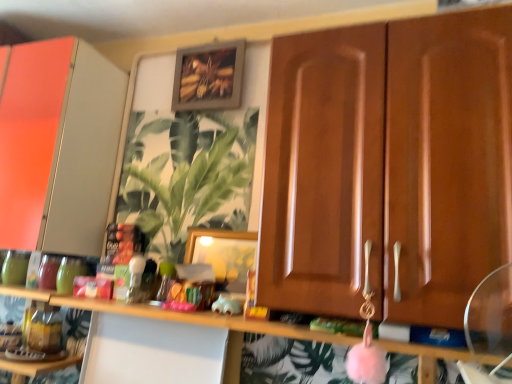
Question: Are wooden cabinet doors at center, which is the 2th cabinetry in left-to-right order, and wooden frame at upper center, marked as the 1th picture frame in a top-to-bottom arrangement, located far from each other?

Choices:
 (A) no
 (B) yes

Answer: (A)

Question: Is wooden cabinet doors at center, which is the 2th cabinetry in left-to-right order, facing towards wooden frame at upper center, acting as the second picture frame starting from the front?

Choices:
 (A) no
 (B) yes

Answer: (A)

Question: Is wooden cabinet doors at center, which is the 2th cabinetry in left-to-right order, bigger than wooden frame at upper center, marked as the 1th picture frame in a top-to-bottom arrangement?

Choices:
 (A) yes
 (B) no

Answer: (A)

Question: Can you confirm if wooden cabinet doors at center, which is the first cabinetry in front-to-back order, is taller than wooden frame at upper center, which is the 1th picture frame in back-to-front order?

Choices:
 (A) yes
 (B) no

Answer: (A)

Question: Is wooden cabinet doors at center, the first cabinetry viewed from the right, shorter than wooden frame at upper center, the 2th picture frame positioned from the bottom?

Choices:
 (A) yes
 (B) no

Answer: (B)

Question: Considering the positions of pink fuzzy ball at center and wooden frame at upper center, which is the 1th picture frame in back-to-front order, in the image, is pink fuzzy ball at center wider or thinner than wooden frame at upper center, which is the 1th picture frame in back-to-front order,?

Choices:
 (A) thin
 (B) wide

Answer: (B)

Question: Would you say pink fuzzy ball at center is inside or outside wooden frame at upper center, acting as the second picture frame starting from the front?

Choices:
 (A) outside
 (B) inside

Answer: (A)

Question: From the image's perspective, is pink fuzzy ball at center above or below wooden frame at upper center, the 2th picture frame positioned from the bottom?

Choices:
 (A) below
 (B) above

Answer: (A)

Question: From a real-world perspective, relative to wooden frame at upper center, which is the 1th picture frame in back-to-front order, is pink fuzzy ball at center vertically above or below?

Choices:
 (A) above
 (B) below

Answer: (B)

Question: Considering the positions of pink fuzzy ball at center and wooden picture frame at center, the 2th picture frame positioned from the back, in the image, is pink fuzzy ball at center wider or thinner than wooden picture frame at center, the 2th picture frame positioned from the back,?

Choices:
 (A) wide
 (B) thin

Answer: (A)

Question: Is pink fuzzy ball at center inside the boundaries of wooden picture frame at center, the 2th picture frame when ordered from top to bottom, or outside?

Choices:
 (A) outside
 (B) inside

Answer: (A)

Question: Considering the relative positions of pink fuzzy ball at center and wooden picture frame at center, positioned as the first picture frame in bottom-to-top order, in the image provided, is pink fuzzy ball at center to the left or to the right of wooden picture frame at center, positioned as the first picture frame in bottom-to-top order,?

Choices:
 (A) left
 (B) right

Answer: (B)

Question: Is pink fuzzy ball at center in front of or behind wooden picture frame at center, the 2th picture frame when ordered from top to bottom, in the image?

Choices:
 (A) behind
 (B) front

Answer: (B)

Question: In terms of size, does matte white cabinet at left, the 2th cabinetry when ordered from right to left, appear bigger or smaller than wooden cabinet doors at center, the 2th cabinetry when ordered from back to front?

Choices:
 (A) small
 (B) big

Answer: (B)

Question: From the image's perspective, is matte white cabinet at left, the 1th cabinetry positioned from the left, positioned above or below wooden cabinet doors at center, the 2th cabinetry when ordered from back to front?

Choices:
 (A) below
 (B) above

Answer: (B)